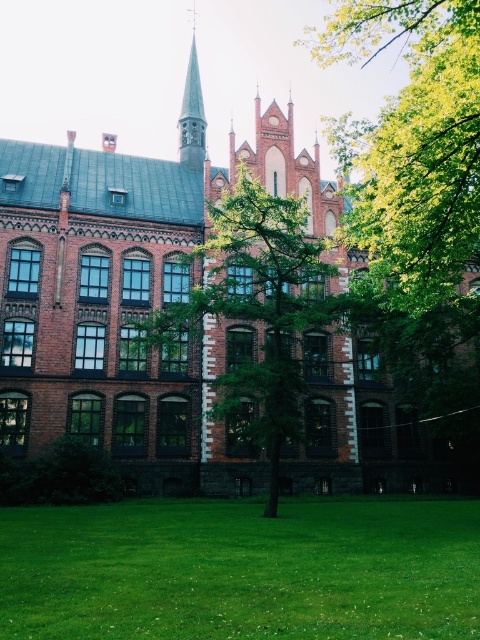
Based on the scene described, which object occupies more horizontal space in the image? Please consider the green grass at lower center and the smooth gray steeple at upper center in your analysis.

The green grass at lower center might be wider than the smooth gray steeple at upper center, so it likely occupies more horizontal space in the image.

From the picture: You are a landscape architect designing a new garden. You observe the green grass at lower center and the green leafy tree at center in the image. Which object is positioned closer to the ground?

The green grass at lower center is positioned closer to the ground as it is located below the green leafy tree at center.

You are standing in front of the historic building and want to take a photo that includes both the green leafy tree at center and the smooth gray steeple at upper center. Based on their positions, which object should you position closer to the left side of your camera frame?

The smooth gray steeple at upper center should be positioned closer to the left side of your camera frame because the green leafy tree at center is to the right of it.